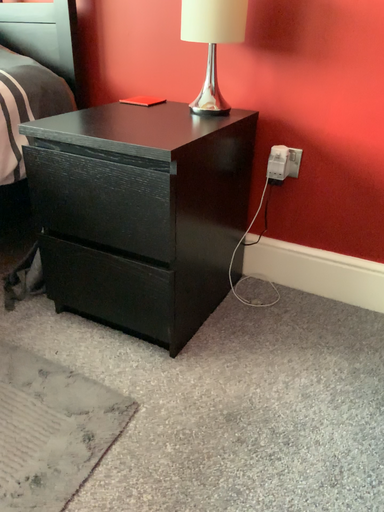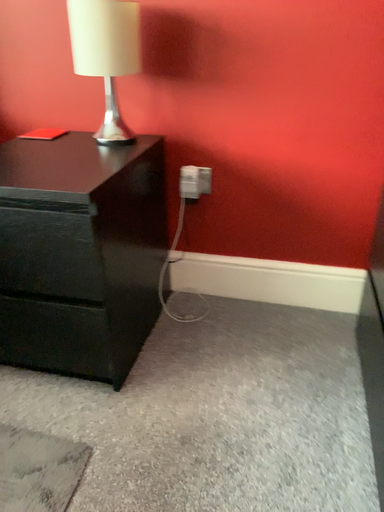
Question: How did the camera likely rotate when shooting the video?

Choices:
 (A) rotated right
 (B) rotated left

Answer: (A)